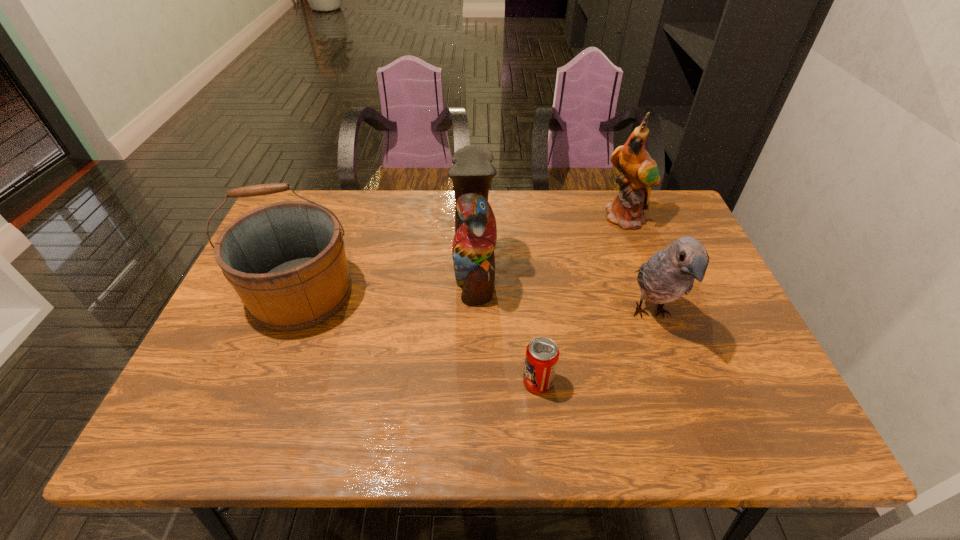
The width and height of the screenshot is (960, 540). I want to click on the farthest object, so tap(640, 171).

Where is `bucket`? The width and height of the screenshot is (960, 540). bucket is located at coordinates (286, 260).

Locate an element on the screen. the second object from left to right is located at coordinates (475, 237).

Find the location of a particular element. The width and height of the screenshot is (960, 540). the second shortest object is located at coordinates (670, 273).

Where is `the third object from right to left`? the third object from right to left is located at coordinates (542, 354).

Where is `the shortest object`? the shortest object is located at coordinates (542, 354).

Identify the location of free space located 0.090m on the front-facing side of the farthest parrot. The image size is (960, 540). (640, 253).

Where is `vacant space located 0.360m on the right of the leftmost object`? This screenshot has height=540, width=960. vacant space located 0.360m on the right of the leftmost object is located at coordinates (499, 293).

Where is `free space located 0.350m at the face of the second object from left to right`? The height and width of the screenshot is (540, 960). free space located 0.350m at the face of the second object from left to right is located at coordinates (627, 275).

Locate an element on the screen. The image size is (960, 540). vacant space located on the front-facing side of the second shortest object is located at coordinates (689, 422).